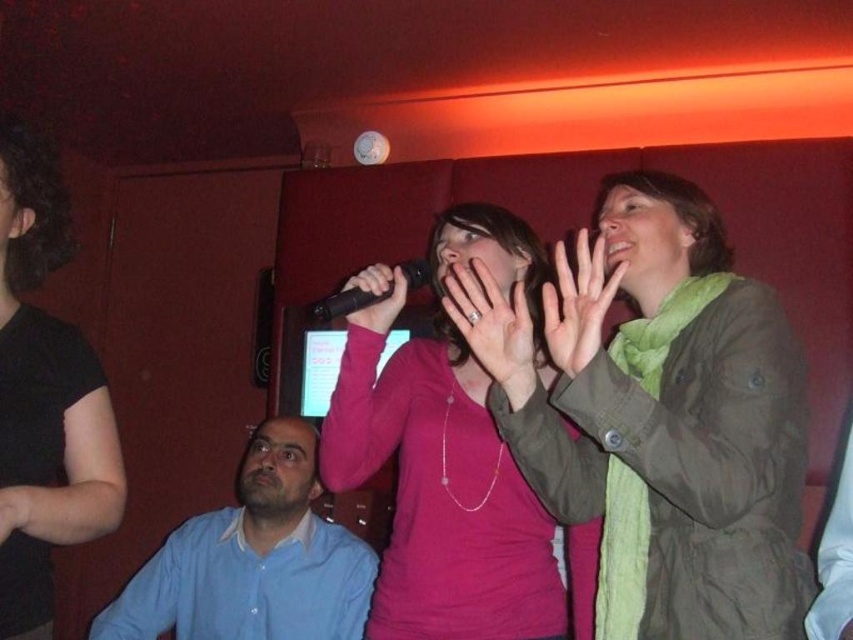
Question: Which is nearer to the black shirt at left?

Choices:
 (A) matte pink shirt at center
 (B) black plastic microphone at center

Answer: (B)

Question: Which point is closer to the camera taking this photo?

Choices:
 (A) (169, 582)
 (B) (415, 260)
 (C) (387, 305)

Answer: (C)

Question: Observing the image, what is the correct spatial positioning of matte black microphone at center in reference to black plastic microphone at center?

Choices:
 (A) below
 (B) above

Answer: (B)

Question: Is black shirt at left positioned before blue button-down shirt at lower left?

Choices:
 (A) no
 (B) yes

Answer: (B)

Question: Which point is closer to the camera?

Choices:
 (A) blue button-down shirt at lower left
 (B) green matte jacket at upper right
 (C) black shirt at left
 (D) pink matte shirt at center

Answer: (C)

Question: In this image, where is matte pink shirt at center located relative to matte black microphone at center?

Choices:
 (A) right
 (B) left

Answer: (A)